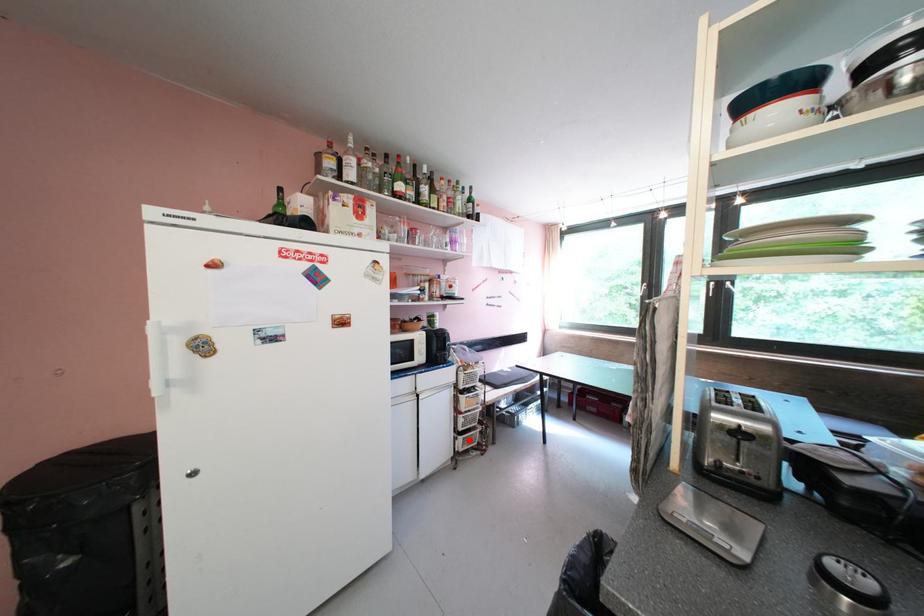
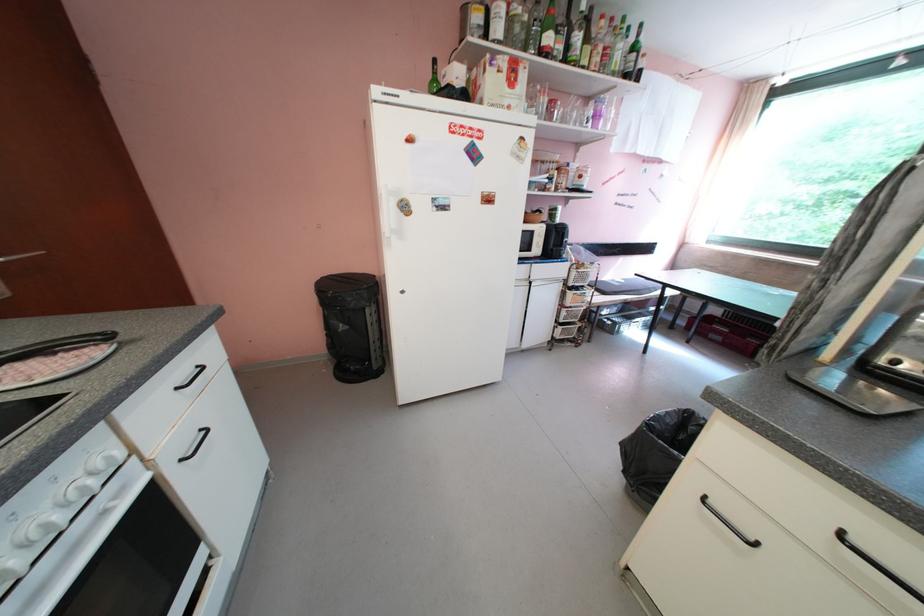
Question: A red point is marked in image1. In image2, is the corresponding 3D point closer to the camera or farther? Reply with the corresponding letter.

Choices:
 (A) The corresponding 3D point is closer.
 (B) The corresponding 3D point is farther.

Answer: (A)